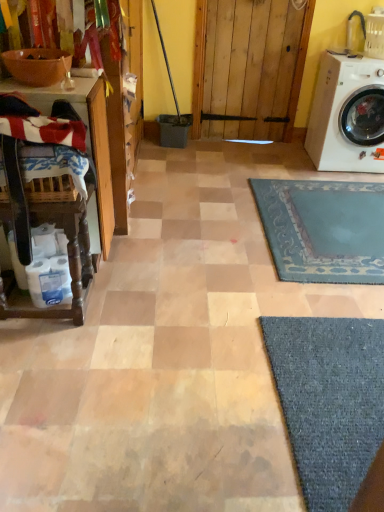
Identify the location of wooden table at left, the 1th table in the bottom-to-top sequence. (69, 265).

What is the approximate width of striped cotton laundry at left?

striped cotton laundry at left is 15.30 inches in width.

This screenshot has width=384, height=512. I want to click on matte brown bowl at upper left, so click(x=37, y=66).

The width and height of the screenshot is (384, 512). I want to click on white plastic washing machine at right, so click(347, 114).

The height and width of the screenshot is (512, 384). Identify the location of wooden table at left, the 1th table in the bottom-to-top sequence. (69, 265).

From a real-world perspective, which is physically above, white plastic washing machine at right or striped cotton laundry at left?

From a 3D spatial view, striped cotton laundry at left is above.

Is white plastic washing machine at right wider than striped cotton laundry at left?

Yes, white plastic washing machine at right is wider than striped cotton laundry at left.

Is white plastic washing machine at right taller than striped cotton laundry at left?

Yes.

Is wooden table at left, the first table viewed from the top, surrounding wooden table at left, the 1th table in the bottom-to-top sequence?

No, wooden table at left, the first table viewed from the top, does not contain wooden table at left, the 1th table in the bottom-to-top sequence.

Considering the sizes of wooden table at left, the first table viewed from the top, and wooden table at left, marked as the 2th table in a top-to-bottom arrangement, in the image, is wooden table at left, the first table viewed from the top, bigger or smaller than wooden table at left, marked as the 2th table in a top-to-bottom arrangement,?

Clearly, wooden table at left, the first table viewed from the top, is larger in size than wooden table at left, marked as the 2th table in a top-to-bottom arrangement.

Does wooden table at left, the first table viewed from the top, appear on the right side of wooden table at left, the 1th table in the bottom-to-top sequence?

No, wooden table at left, the first table viewed from the top, is not to the right of wooden table at left, the 1th table in the bottom-to-top sequence.

Identify the location of washing machine below the wooden table at left, the first table viewed from the top (from a real-world perspective). (347, 114).

Is wooden table at left, the second table from the bottom, surrounding white plastic washing machine at right?

No.

Does wooden table at left, the first table viewed from the top, have a larger size compared to white plastic washing machine at right?

Incorrect, wooden table at left, the first table viewed from the top, is not larger than white plastic washing machine at right.

Consider the image. Which object is positioned more to the right, wooden table at left, the first table viewed from the top, or striped cotton laundry at left?

striped cotton laundry at left.

Can you confirm if wooden table at left, the first table viewed from the top, is shorter than striped cotton laundry at left?

In fact, wooden table at left, the first table viewed from the top, may be taller than striped cotton laundry at left.

Looking at the image, does wooden table at left, the first table viewed from the top, seem bigger or smaller compared to striped cotton laundry at left?

Considering their sizes, wooden table at left, the first table viewed from the top, takes up more space than striped cotton laundry at left.

Is point (107, 166) positioned in front of point (73, 136)?

No, it is not.

Considering the positions of objects wooden table at left, marked as the 2th table in a top-to-bottom arrangement, and striped cotton laundry at left in the image provided, who is behind, wooden table at left, marked as the 2th table in a top-to-bottom arrangement, or striped cotton laundry at left?

wooden table at left, marked as the 2th table in a top-to-bottom arrangement.

Is wooden table at left, the 1th table in the bottom-to-top sequence, far from striped cotton laundry at left?

No, wooden table at left, the 1th table in the bottom-to-top sequence, is in close proximity to striped cotton laundry at left.

Find the location of `the 2nd table positioned below the striped cotton laundry at left (from a real-world perspective)`. the 2nd table positioned below the striped cotton laundry at left (from a real-world perspective) is located at coordinates (69, 265).

Considering the positions of objects wooden table at left, marked as the 2th table in a top-to-bottom arrangement, and striped cotton laundry at left in the image provided, who is more to the right, wooden table at left, marked as the 2th table in a top-to-bottom arrangement, or striped cotton laundry at left?

striped cotton laundry at left is more to the right.

Is striped cotton laundry at left taller or shorter than wooden table at left, the first table viewed from the top?

In the image, striped cotton laundry at left appears to be shorter than wooden table at left, the first table viewed from the top.

How much distance is there between striped cotton laundry at left and wooden table at left, the first table viewed from the top?

They are 25.80 centimeters apart.

Between point (50, 119) and point (93, 132), which one is positioned behind?

Positioned behind is point (93, 132).

The image size is (384, 512). Identify the location of laundry above the wooden table at left, the first table viewed from the top (from the image's perspective). (41, 123).

Which is more to the right, matte brown bowl at upper left or white plastic washing machine at right?

Positioned to the right is white plastic washing machine at right.

Is matte brown bowl at upper left not near white plastic washing machine at right?

Absolutely, matte brown bowl at upper left is distant from white plastic washing machine at right.

Does matte brown bowl at upper left have a greater height compared to white plastic washing machine at right?

No, matte brown bowl at upper left is not taller than white plastic washing machine at right.

In the scene shown: Relative to white plastic washing machine at right, is matte brown bowl at upper left in front or behind?

In the image, matte brown bowl at upper left appears in front of white plastic washing machine at right.

Image resolution: width=384 pixels, height=512 pixels. Find the location of `laundry that appears on the left of white plastic washing machine at right`. laundry that appears on the left of white plastic washing machine at right is located at coordinates (41, 123).

The image size is (384, 512). Find the location of `table above the wooden table at left, marked as the 2th table in a top-to-bottom arrangement (from a real-world perspective)`. table above the wooden table at left, marked as the 2th table in a top-to-bottom arrangement (from a real-world perspective) is located at coordinates (72, 205).

Based on their spatial positions, is matte brown bowl at upper left or white plastic washing machine at right closer to striped cotton laundry at left?

Among the two, matte brown bowl at upper left is located nearer to striped cotton laundry at left.

When comparing their distances from wooden table at left, the second table from the bottom, does striped cotton laundry at left or white plastic washing machine at right seem further?

The object further to wooden table at left, the second table from the bottom, is white plastic washing machine at right.

Based on their spatial positions, is striped cotton laundry at left or wooden table at left, the second table from the bottom, closer to white plastic washing machine at right?

Based on the image, wooden table at left, the second table from the bottom, appears to be nearer to white plastic washing machine at right.

When comparing their distances from striped cotton laundry at left, does white plastic washing machine at right or matte brown bowl at upper left seem closer?

Based on the image, matte brown bowl at upper left appears to be nearer to striped cotton laundry at left.

When comparing their distances from wooden table at left, the 1th table in the bottom-to-top sequence, does striped cotton laundry at left or matte brown bowl at upper left seem closer?

striped cotton laundry at left is positioned closer to the anchor wooden table at left, the 1th table in the bottom-to-top sequence.

Which object lies nearer to the anchor point white plastic washing machine at right, striped cotton laundry at left or matte brown bowl at upper left?

matte brown bowl at upper left lies closer to white plastic washing machine at right than the other object.

From the image, which object appears to be nearer to white plastic washing machine at right, matte brown bowl at upper left or wooden table at left, the first table viewed from the top?

wooden table at left, the first table viewed from the top.

Considering their positions, is white plastic washing machine at right positioned closer to wooden table at left, the second table from the bottom, than striped cotton laundry at left?

striped cotton laundry at left is closer to wooden table at left, the second table from the bottom.

The image size is (384, 512). I want to click on laundry that lies between matte brown bowl at upper left and wooden table at left, the first table viewed from the top, from top to bottom, so click(x=41, y=123).

Image resolution: width=384 pixels, height=512 pixels. In order to click on table between striped cotton laundry at left and wooden table at left, marked as the 2th table in a top-to-bottom arrangement, in the up-down direction in this screenshot , I will do `click(72, 205)`.

Find the location of a particular element. This screenshot has height=512, width=384. sink located between wooden table at left, the second table from the bottom, and white plastic washing machine at right in the left-right direction is located at coordinates (37, 66).

Image resolution: width=384 pixels, height=512 pixels. In order to click on table between matte brown bowl at upper left and white plastic washing machine at right from left to right in this screenshot , I will do `click(69, 265)`.